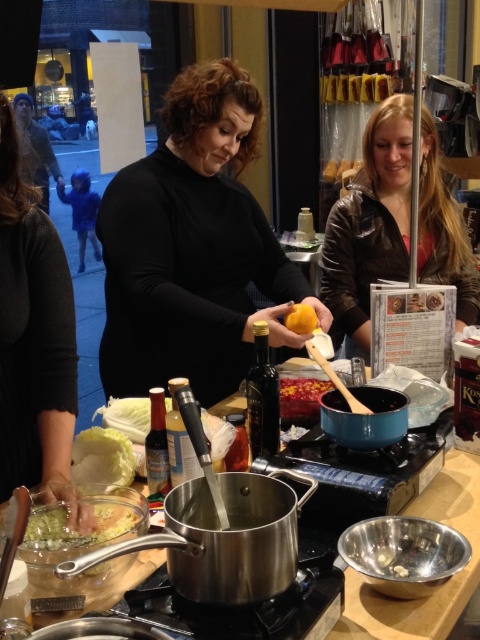
You are a chef preparing a dish and need to know which ingredient is taller between the white creamy cabbage at lower left and the smooth red sauce at center. Can you determine this based on the setup?

The white creamy cabbage at lower left is taller than the smooth red sauce at center, so the white creamy cabbage at lower left is taller.

You are preparing a dish and need to know which ingredient occupies more space horizontally. Looking at the white creamy cabbage at lower left and the smooth red sauce at center, which one is wider?

The white creamy cabbage at lower left is wider than the smooth red sauce at center according to the description provided.

You are a guest at the cooking event and need to store your belongings. You have a small backpack that is 30 cm in width. You see the brown leather jacket at upper right and the translucent plastic container at lower left. Which item can your backpack fit next to it?

The translucent plastic container at lower left is smaller than the brown leather jacket at upper right. Since your backpack is 30 cm wide, it might fit next to the translucent plastic container at lower left but not the larger jacket.